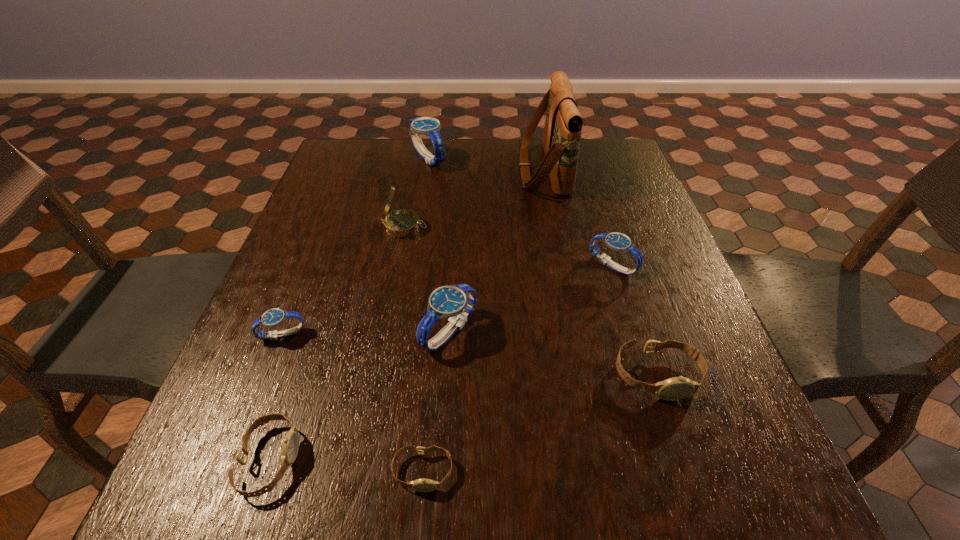
Locate an element on the screen. unoccupied position between the rightmost beige watch and the third nearest blue watch is located at coordinates (635, 321).

At what (x,y) coordinates should I click in order to perform the action: click on vacant space that is in between the rightmost blue watch and the second beige watch from right to left. Please return your answer as a coordinate pair (x, y). Looking at the image, I should click on (517, 369).

At what (x,y) coordinates should I click in order to perform the action: click on empty location between the second biggest beige watch and the farthest watch. Please return your answer as a coordinate pair (x, y). The height and width of the screenshot is (540, 960). Looking at the image, I should click on (349, 309).

Locate an element on the screen. The image size is (960, 540). free space that is in between the leftmost blue watch and the farthest watch is located at coordinates (355, 247).

Image resolution: width=960 pixels, height=540 pixels. I want to click on object that stands as the fifth closest to the second farthest blue watch, so click(x=422, y=485).

Where is `object that is the seventh closest one to the tallest object`? The width and height of the screenshot is (960, 540). object that is the seventh closest one to the tallest object is located at coordinates click(422, 485).

The width and height of the screenshot is (960, 540). I want to click on the fifth closest watch to the tallest object, so click(273, 317).

The image size is (960, 540). I want to click on watch that stands as the third closest to the leftmost blue watch, so click(x=422, y=485).

Where is `blue watch that can be found as the closest to the biggest beige watch`? This screenshot has height=540, width=960. blue watch that can be found as the closest to the biggest beige watch is located at coordinates (619, 242).

Point out which blue watch is positioned as the third nearest to the smallest blue watch. Please provide its 2D coordinates. Your answer should be formatted as a tuple, i.e. [(x, y)], where the tuple contains the x and y coordinates of a point satisfying the conditions above.

[(619, 242)]